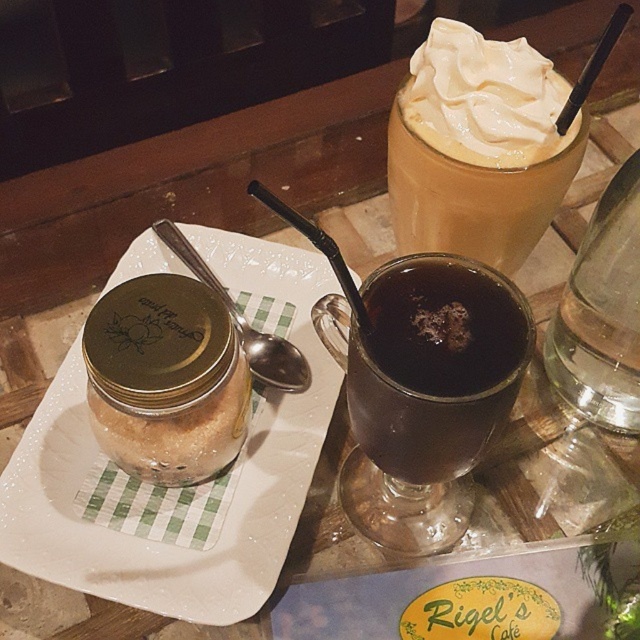
You are a barista who needs to place a new cup on the tray. The cup must be placed above the dark brown glass mug at center but not overlapping with the matte gold jar at left. Is there enough space?

The dark brown glass mug at center is positioned under the matte gold jar at left, so placing the new cup above the dark brown glass mug at center would mean placing it where the matte gold jar at left is already located. Therefore, there is no space available for the new cup without overlapping the jar.

You are a customer at the cozy cafe and want to reach for both the dark brown glass mug at center and the matte gold jar at left. Which object will your hand encounter first?

The dark brown glass mug at center is closer to you than the matte gold jar at left, so your hand will encounter the dark brown glass mug at center first.